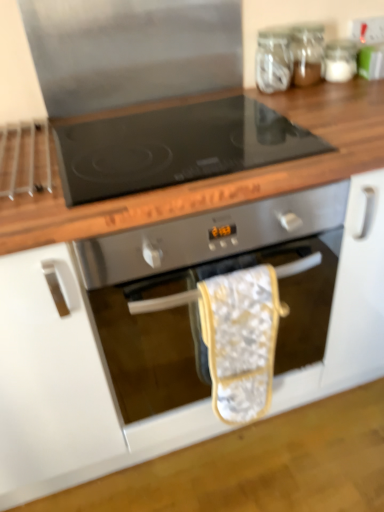
I want to click on vacant space in front of transparent glass jar at upper right, marked as the 1th glass jar in a right-to-left arrangement, so click(345, 92).